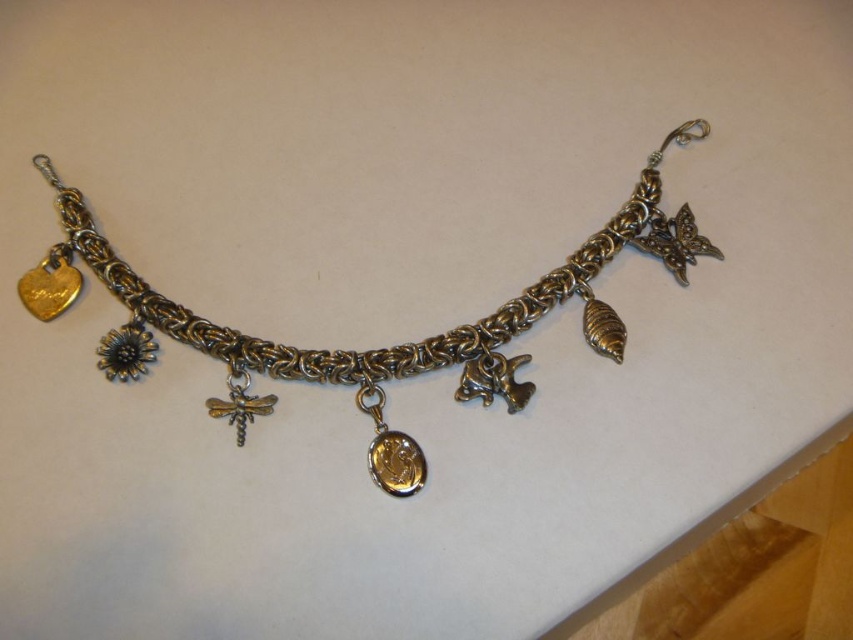
Question: Can you confirm if gold plated medallion at center is thinner than silver metallic dragonfly at center?

Choices:
 (A) no
 (B) yes

Answer: (A)

Question: Can you confirm if antique gold chain at center is positioned below gold plated medallion at center?

Choices:
 (A) yes
 (B) no

Answer: (B)

Question: Which of these objects is positioned closest to the silver metallic dragonfly at center?

Choices:
 (A) antique gold chain at center
 (B) gold plated medallion at center

Answer: (B)

Question: Which object appears farthest from the camera in this image?

Choices:
 (A) antique gold chain at center
 (B) silver metallic dragonfly at center

Answer: (A)

Question: Which point is closer to the camera?

Choices:
 (A) click(x=119, y=300)
 (B) click(x=241, y=364)

Answer: (B)

Question: Where is antique gold chain at center located in relation to silver metallic dragonfly at center in the image?

Choices:
 (A) below
 (B) above

Answer: (B)